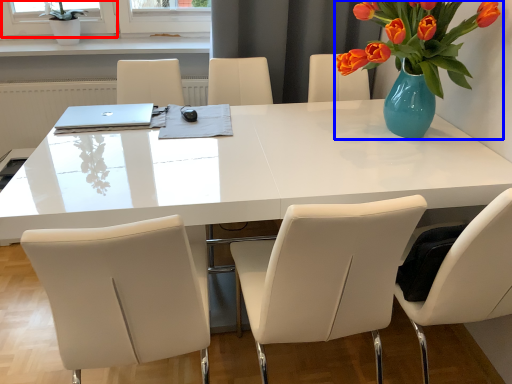
Question: Among these objects, which one is nearest to the camera, window screen (highlighted by a red box) or houseplant (highlighted by a blue box)?

Choices:
 (A) window screen
 (B) houseplant

Answer: (B)